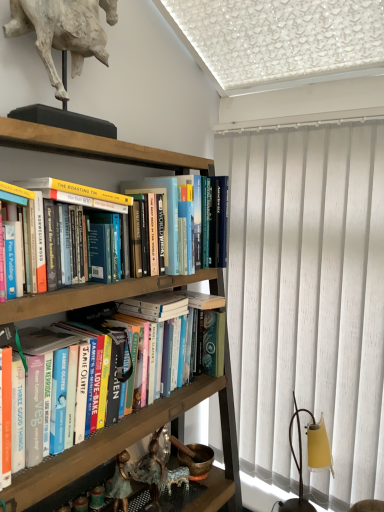
Question: Considering the positions of hardcover books at center, which is the second book in top-to-bottom order, and white vertical blinds at right in the image, is hardcover books at center, which is the second book in top-to-bottom order, wider or thinner than white vertical blinds at right?

Choices:
 (A) thin
 (B) wide

Answer: (B)

Question: In the image, is hardcover books at center, which is the second book in top-to-bottom order, on the left side or the right side of white vertical blinds at right?

Choices:
 (A) left
 (B) right

Answer: (A)

Question: Estimate the real-world distances between objects in this image. Which object is farther from the hardcover books at center, which appears as the 1th book when ordered from the bottom?

Choices:
 (A) white plaster horse at upper left
 (B) white vertical blinds at right
 (C) hardcover books at center, which is the first book from top to bottom
 (D) wooden bookshelf at upper left

Answer: (A)

Question: Considering the real-world distances, which object is farthest from the white vertical blinds at right?

Choices:
 (A) hardcover books at center, which is the first book from top to bottom
 (B) hardcover books at center, which is the second book in top-to-bottom order
 (C) wooden bookshelf at upper left
 (D) white plaster horse at upper left

Answer: (D)